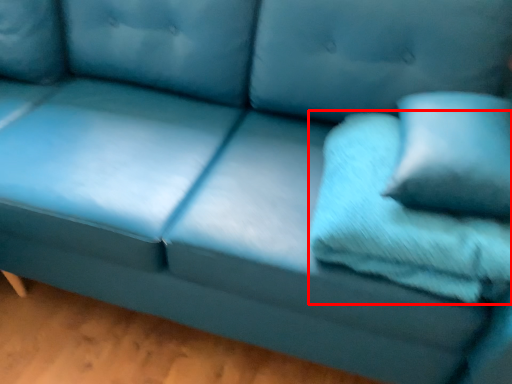
Question: From the image's perspective, where is pillow (annotated by the red box) located relative to pillow?

Choices:
 (A) above
 (B) below

Answer: (B)